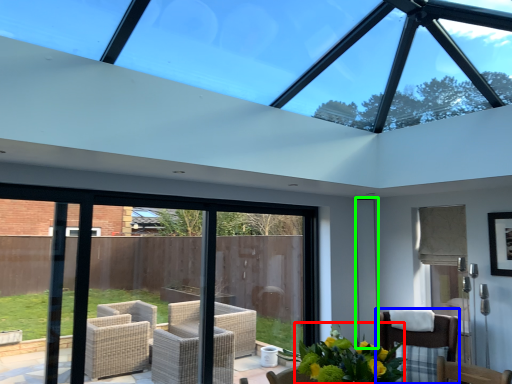
Question: Estimate the real-world distances between objects in this image. Which object is farther from floral arrangement (highlighted by a red box), chair (highlighted by a blue box) or screen door (highlighted by a green box)?

Choices:
 (A) chair
 (B) screen door

Answer: (B)